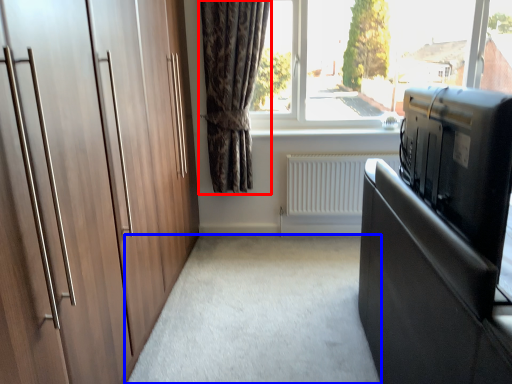
Question: Which point is further to the camera, curtain (highlighted by a red box) or plain (highlighted by a blue box)?

Choices:
 (A) curtain
 (B) plain

Answer: (A)